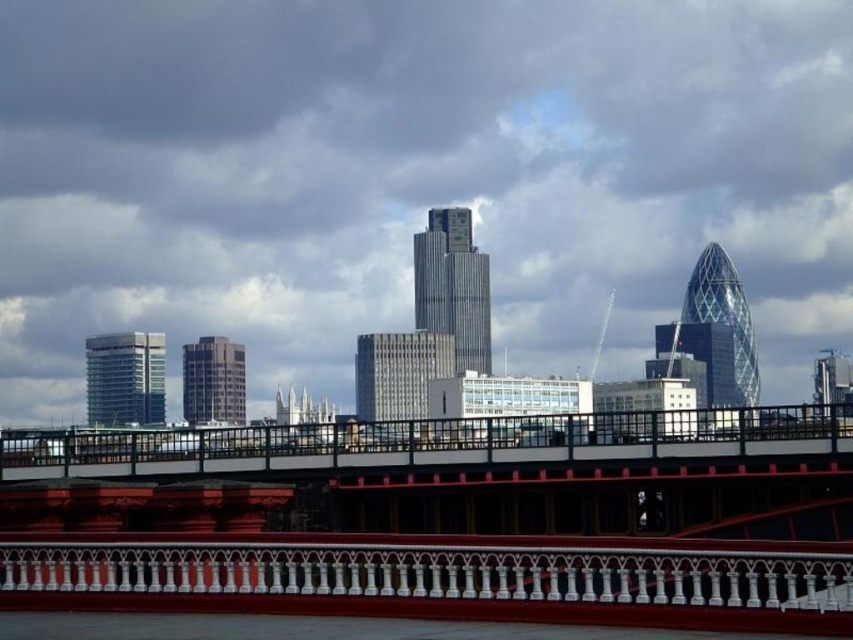
This screenshot has height=640, width=853. Describe the element at coordinates (413, 179) in the screenshot. I see `transparent glass bridge at center` at that location.

Is transparent glass bridge at center thinner than metallic red pedestrian bridge at center?

No, transparent glass bridge at center is not thinner than metallic red pedestrian bridge at center.

Is point (77, 3) farther from camera compared to point (730, 602)?

Yes, point (77, 3) is behind point (730, 602).

Find the location of a particular element. This screenshot has width=853, height=640. transparent glass bridge at center is located at coordinates (413, 179).